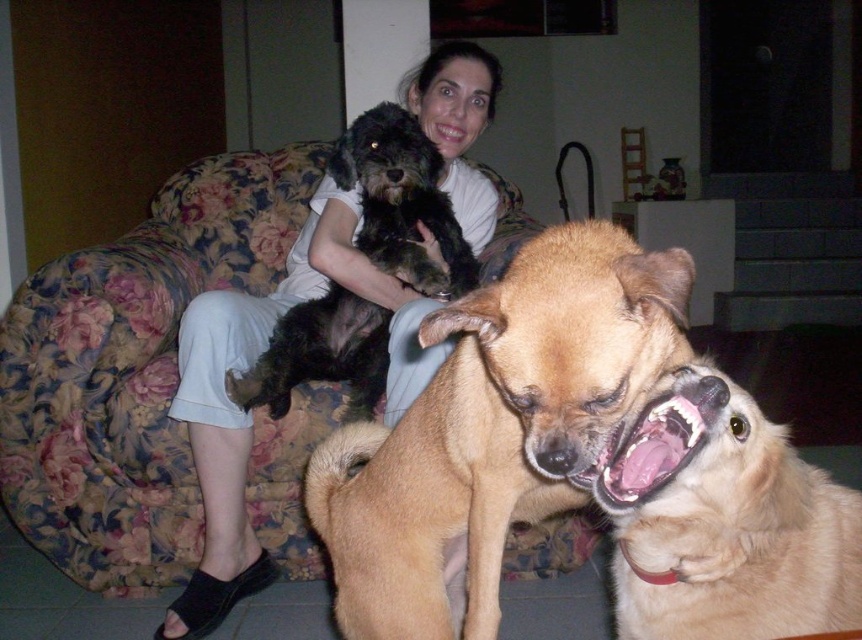
Question: Which of the following is the closest to the observer?

Choices:
 (A) golden fur dog at lower right
 (B) light brown fur dog at center
 (C) white cotton shirt at upper center

Answer: (A)

Question: From the image, what is the correct spatial relationship of white cotton shirt at upper center in relation to shaggy black dog at upper center?

Choices:
 (A) below
 (B) above

Answer: (A)

Question: Does white cotton shirt at upper center appear on the right side of shaggy black dog at upper center?

Choices:
 (A) no
 (B) yes

Answer: (A)

Question: Considering the real-world distances, which object is farthest from the white cotton shirt at upper center?

Choices:
 (A) golden fur dog at lower right
 (B) light brown fur dog at center
 (C) shaggy black dog at upper center

Answer: (A)

Question: Which point is closer to the camera?

Choices:
 (A) pyautogui.click(x=653, y=628)
 (B) pyautogui.click(x=426, y=118)
 (C) pyautogui.click(x=385, y=144)

Answer: (A)

Question: Does golden fur dog at lower right appear on the left side of shaggy black dog at upper center?

Choices:
 (A) no
 (B) yes

Answer: (A)